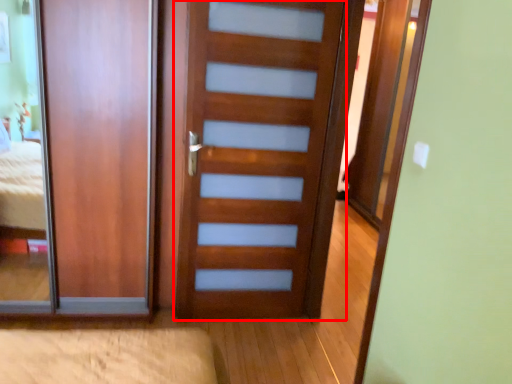
Question: Where is door (annotated by the red box) located in relation to door in the image?

Choices:
 (A) right
 (B) left

Answer: (A)